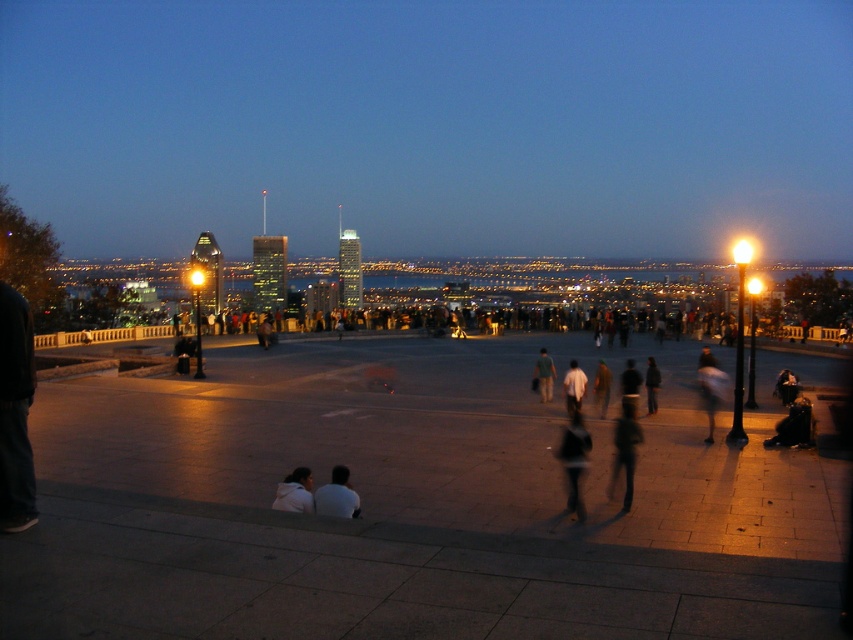
You are a photographer trying to capture a candid shot of the dark gray fabric pants at lower right and the white matte shirt at center. If you want to ensure both subjects are in focus, which one should you prioritize focusing on first?

The dark gray fabric pants at lower right might be wider than the white matte shirt at center, so you should focus on the wider subject first to ensure both are in focus.

You are a photographer aiming to capture a candid shot of the dark gray fabric pants at lower right and the white matte shirt at center in the evening scene. Since you want both subjects to be clearly visible, which one should you focus on first considering their sizes?

The dark gray fabric pants at lower right is bigger than the white matte shirt at center, so you should focus on the dark gray fabric pants at lower right first as it is larger and will require more attention to ensure clarity.

You are standing on the viewing platform and want to take a photo of the white cotton shirt at lower center and the light blue jeans at center. Which one should you focus on first to ensure both are in sharp focus?

You should focus on the white cotton shirt at lower center first because it is closer to you than the light blue jeans at center. By focusing on the closer object, the farther one may still be in focus depending on the depth of field.